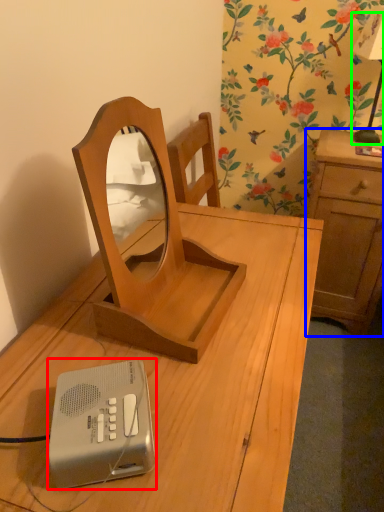
Question: Considering the real-world distances, which object is closest to ipod (highlighted by a red box)? cabinetry (highlighted by a blue box) or bedside lamp (highlighted by a green box).

Choices:
 (A) cabinetry
 (B) bedside lamp

Answer: (A)